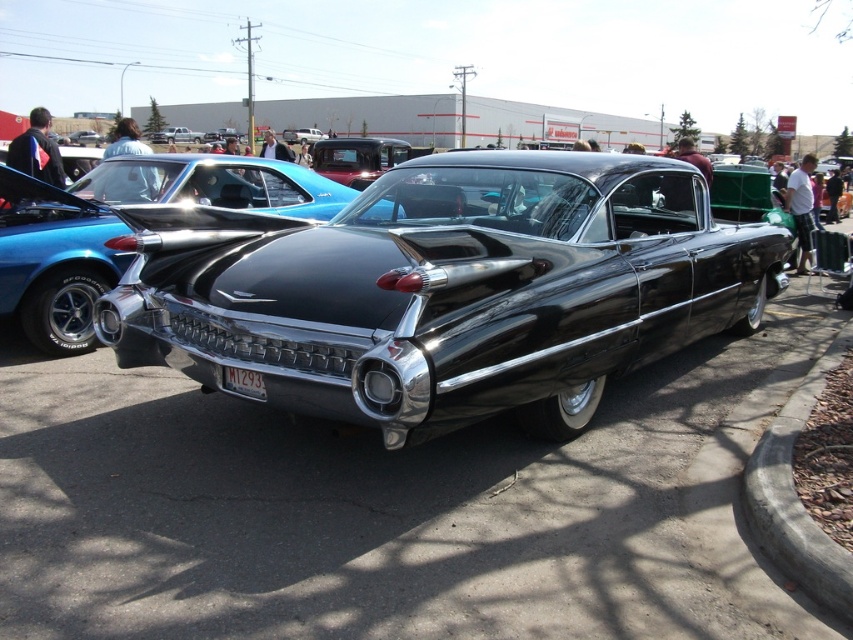
Question: Observing the image, what is the correct spatial positioning of glossy black car at center in reference to shiny black car at center?

Choices:
 (A) below
 (B) above

Answer: (A)

Question: Observing the image, what is the correct spatial positioning of shiny black car at center in reference to white plastic license plate at center?

Choices:
 (A) right
 (B) left

Answer: (B)

Question: Which object is positioned closest to the white plastic license plate at center?

Choices:
 (A) shiny black car at center
 (B) glossy black car at center

Answer: (B)

Question: Which point is farther from the camera taking this photo?

Choices:
 (A) (235, 369)
 (B) (148, 160)
 (C) (492, 380)

Answer: (B)

Question: Can you confirm if shiny black car at center is positioned to the left of white plastic license plate at center?

Choices:
 (A) no
 (B) yes

Answer: (B)

Question: Estimate the real-world distances between objects in this image. Which object is closer to the white plastic license plate at center?

Choices:
 (A) glossy black car at center
 (B) shiny black car at center

Answer: (A)